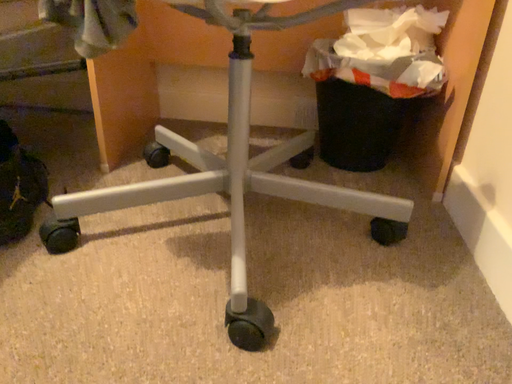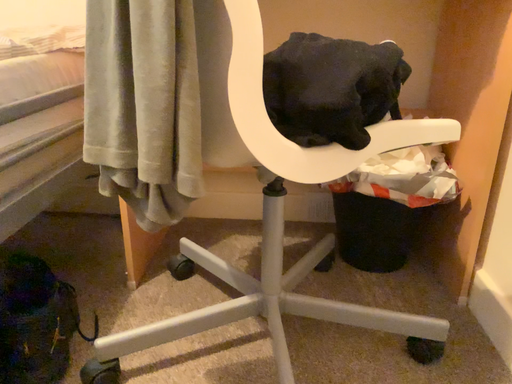
Question: How did the camera likely rotate when shooting the video?

Choices:
 (A) rotated downward
 (B) rotated upward

Answer: (B)